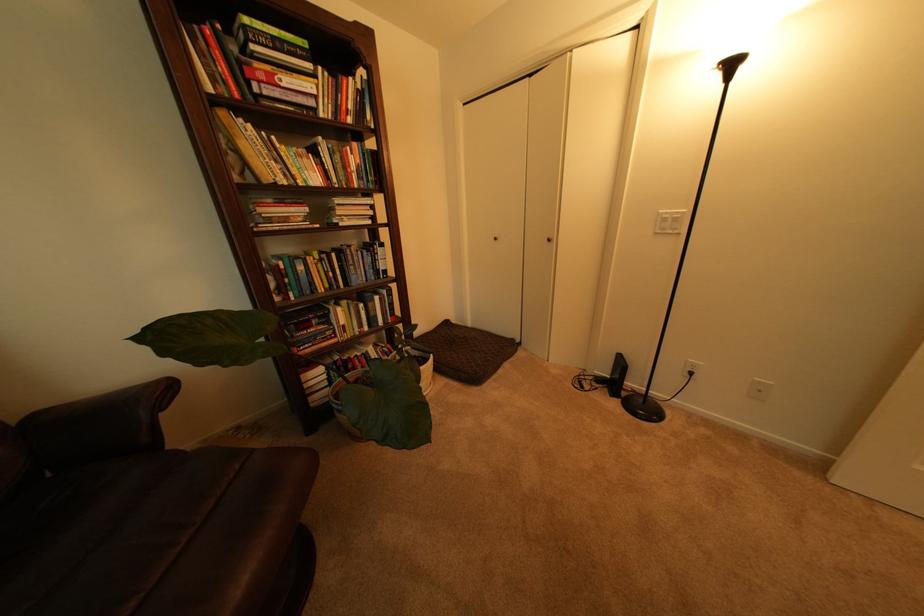
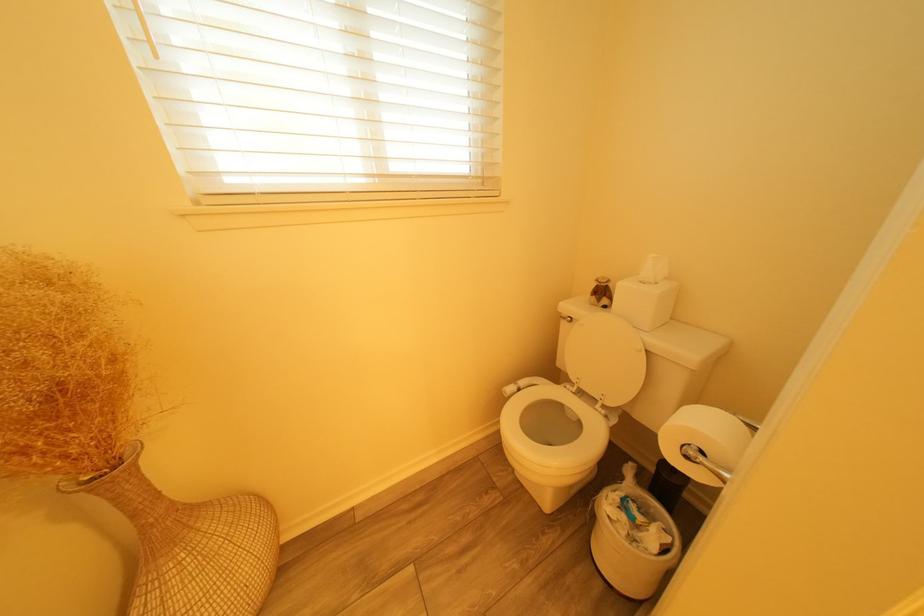
In a continuous first-person perspective shot, in which direction is the camera moving?

The cameraman walked toward right, forward.